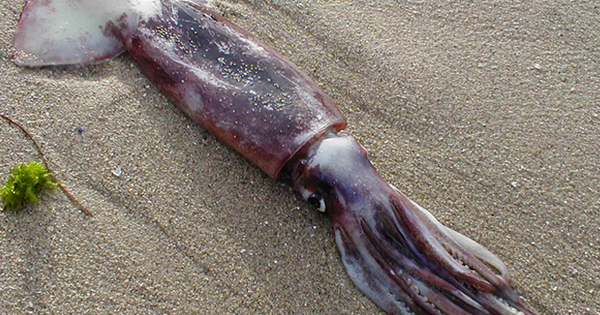
Locate an element on the screen. plant is located at coordinates (26, 187).